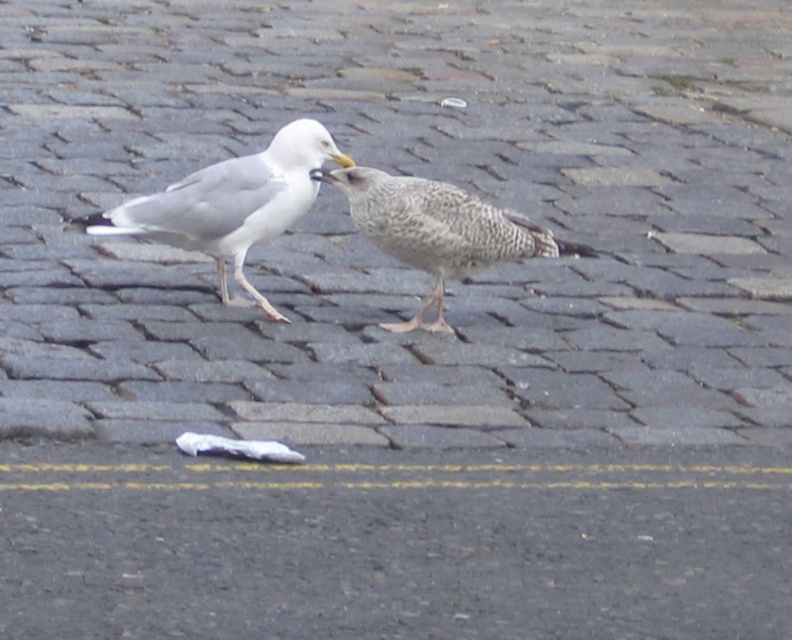
Question: Can you confirm if white matte seagull at center is positioned below speckled feathered bird at center?

Choices:
 (A) yes
 (B) no

Answer: (B)

Question: Does white matte seagull at center have a smaller size compared to speckled feathered bird at center?

Choices:
 (A) yes
 (B) no

Answer: (B)

Question: Can you confirm if white matte seagull at center is positioned to the left of speckled feathered bird at center?

Choices:
 (A) no
 (B) yes

Answer: (B)